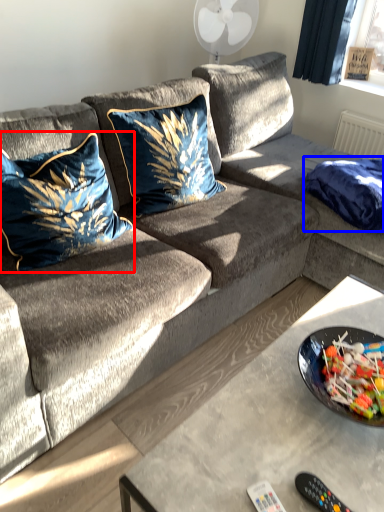
Question: Which of the following is the closest to the observer, pillow (highlighted by a red box) or blanket (highlighted by a blue box)?

Choices:
 (A) pillow
 (B) blanket

Answer: (A)